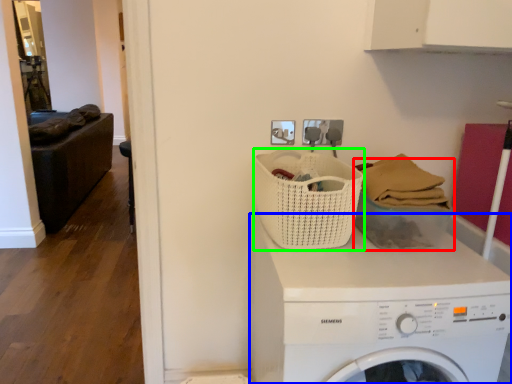
Question: Which object is positioned closest to basket (highlighted by a red box)? Select from washing machine (highlighted by a blue box) and basket (highlighted by a green box).

Choices:
 (A) washing machine
 (B) basket

Answer: (B)